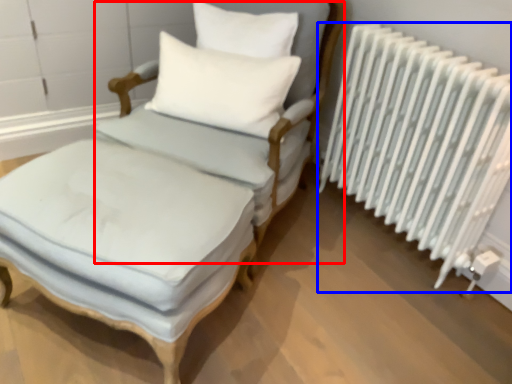
Question: Which of the following is the closest to the observer, armchair (highlighted by a red box) or radiator (highlighted by a blue box)?

Choices:
 (A) armchair
 (B) radiator

Answer: (A)